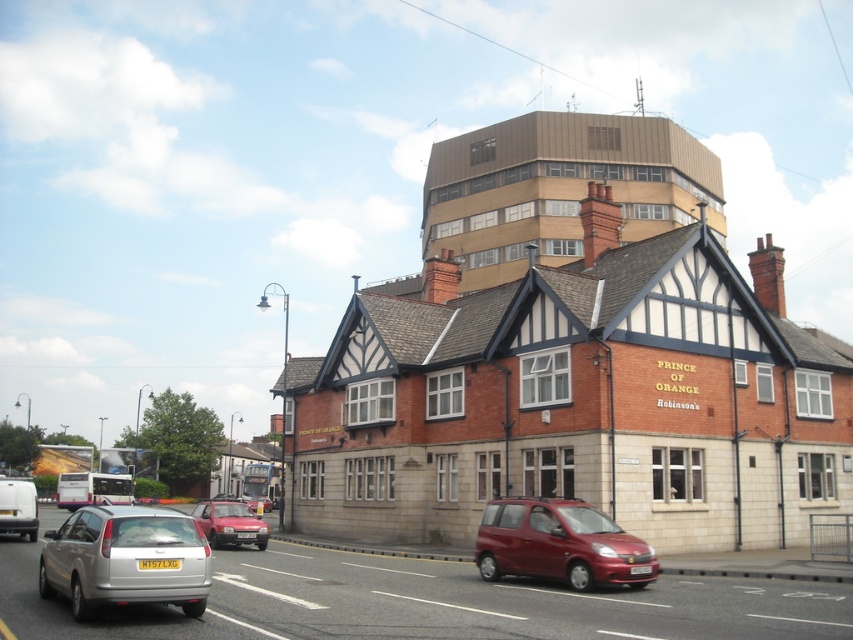
How far apart are metallic red minivan at center and matte red car at center?

metallic red minivan at center is 62.10 feet from matte red car at center.

Is metallic red minivan at center to the right of matte red car at center from the viewer's perspective?

Indeed, metallic red minivan at center is positioned on the right side of matte red car at center.

Image resolution: width=853 pixels, height=640 pixels. What do you see at coordinates (560, 545) in the screenshot?
I see `metallic red minivan at center` at bounding box center [560, 545].

Where is `metallic red minivan at center`? Image resolution: width=853 pixels, height=640 pixels. metallic red minivan at center is located at coordinates (560, 545).

Does silver metallic hatchback at lower left appear over metallic red minivan at center?

No, silver metallic hatchback at lower left is not above metallic red minivan at center.

Is silver metallic hatchback at lower left to the left of metallic red minivan at center from the viewer's perspective?

Indeed, silver metallic hatchback at lower left is positioned on the left side of metallic red minivan at center.

Does point (45, 557) come closer to viewer compared to point (585, 547)?

Yes, point (45, 557) is in front of point (585, 547).

The height and width of the screenshot is (640, 853). Identify the location of silver metallic hatchback at lower left. (126, 560).

Between silver metallic hatchback at lower left and matte red car at center, which one has less height?

silver metallic hatchback at lower left

Can you confirm if silver metallic hatchback at lower left is thinner than matte red car at center?

Yes, silver metallic hatchback at lower left is thinner than matte red car at center.

Measure the distance between silver metallic hatchback at lower left and camera.

They are 26.03 meters apart.

The width and height of the screenshot is (853, 640). What are the coordinates of `silver metallic hatchback at lower left` in the screenshot? It's located at (126, 560).